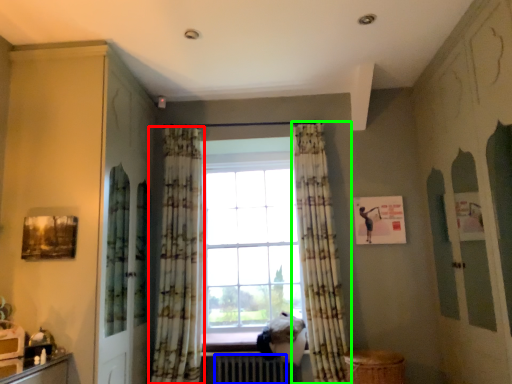
Question: Which object is the closest to the curtain (highlighted by a red box)? Choose among these: radiator (highlighted by a blue box) or curtain (highlighted by a green box).

Choices:
 (A) radiator
 (B) curtain

Answer: (A)